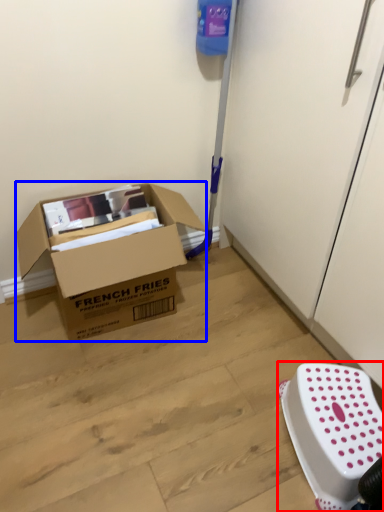
Question: Which object appears closest to the camera in this image, stool (highlighted by a red box) or box (highlighted by a blue box)?

Choices:
 (A) stool
 (B) box

Answer: (A)